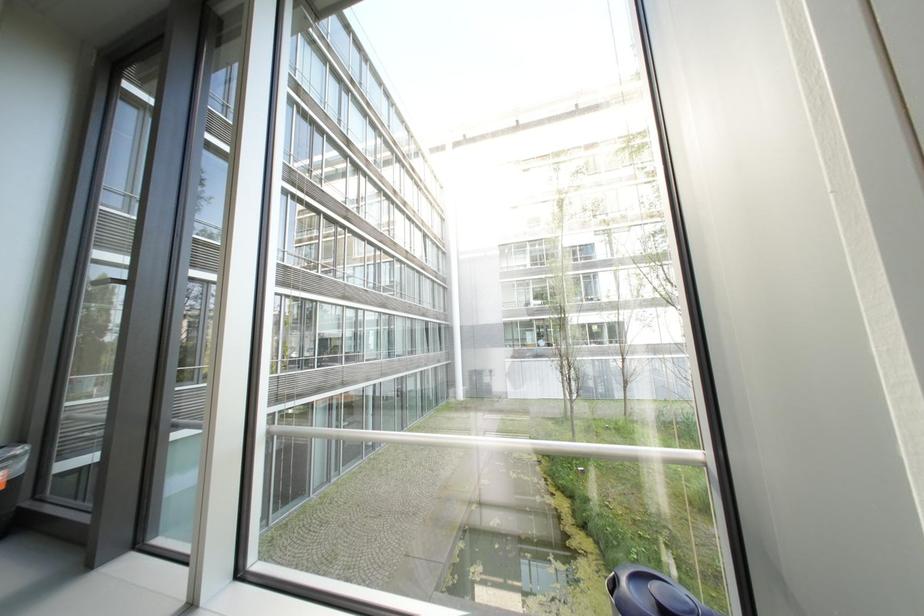
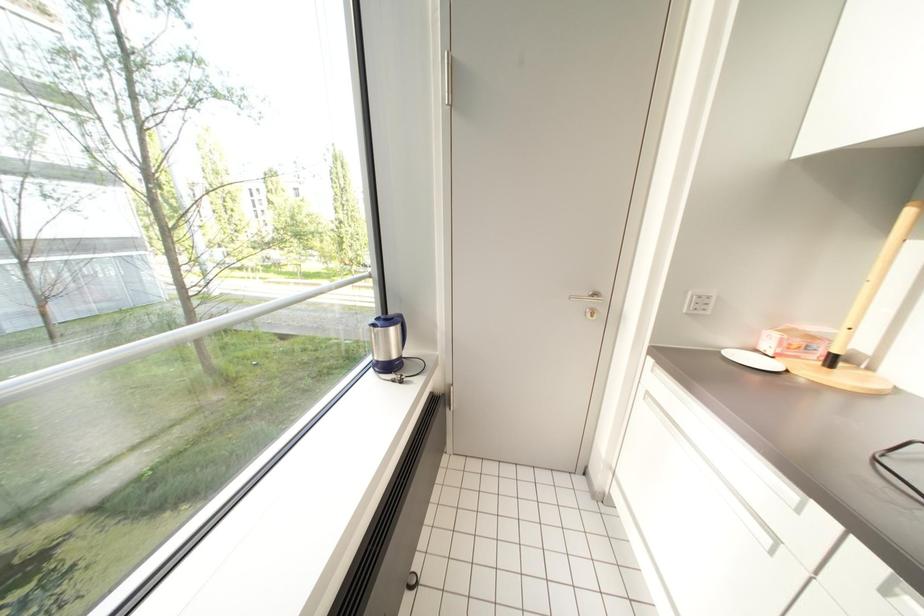
Question: Based on the continuous images, in which direction is the camera rotating? Reply with the corresponding letter.

Choices:
 (A) Left
 (B) Right
 (C) Up
 (D) Down

Answer: (B)